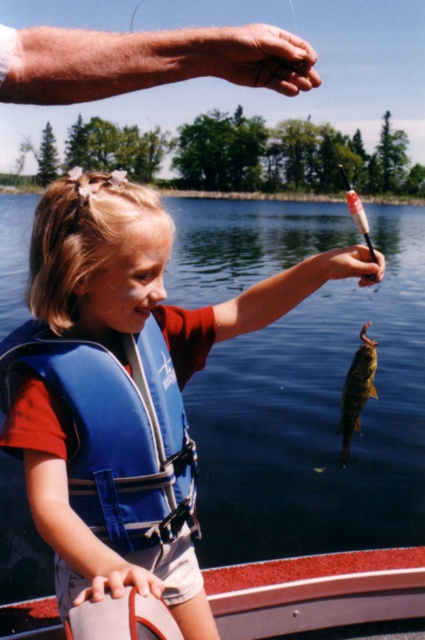
Question: Is blue life vest at center below blue fabric life jacket at left?

Choices:
 (A) no
 (B) yes

Answer: (A)

Question: Which of the following is the farthest from the observer?

Choices:
 (A) (192, 476)
 (B) (351, 385)

Answer: (A)

Question: Which object appears closest to the camera in this image?

Choices:
 (A) blue fabric life jacket at left
 (B) blue life vest at center

Answer: (B)

Question: Does blue fabric life jacket at left come in front of gray fabric boat at lower center?

Choices:
 (A) no
 (B) yes

Answer: (B)

Question: Does blue fabric life jacket at left appear on the left side of gray fabric boat at lower center?

Choices:
 (A) no
 (B) yes

Answer: (B)

Question: Which is farther from the shiny golden fish at lower right?

Choices:
 (A) blue fabric life jacket at left
 (B) blue life vest at center
 (C) gray fabric boat at lower center

Answer: (C)